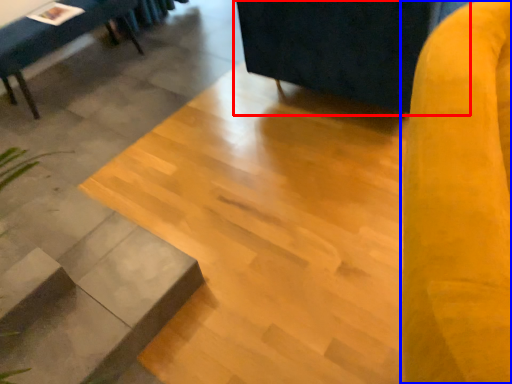
Question: Which of the following is the farthest to the observer, swivel chair (highlighted by a red box) or swivel chair (highlighted by a blue box)?

Choices:
 (A) swivel chair
 (B) swivel chair

Answer: (A)